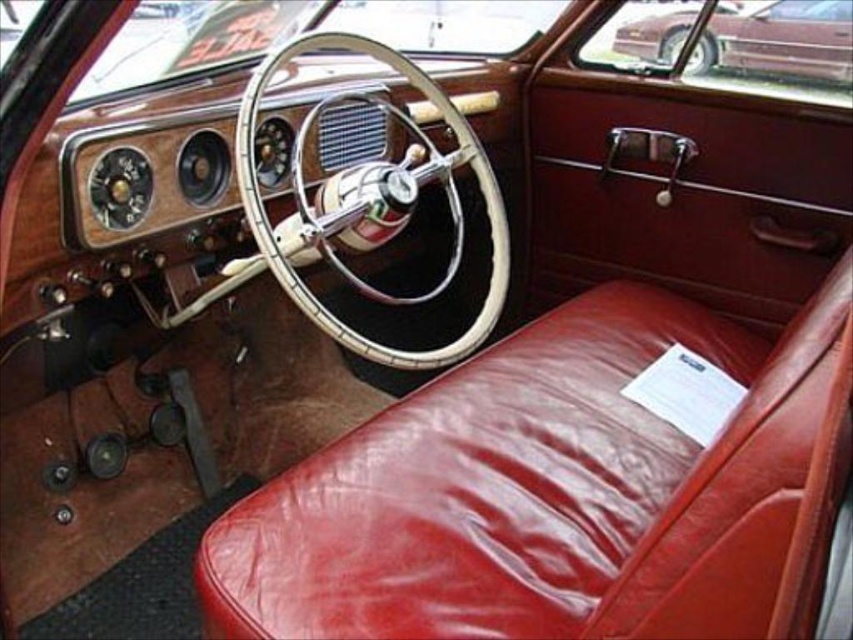
Is point (798, 580) positioned after point (766, 44)?

No, (798, 580) is closer to viewer.

Can you confirm if shiny leather seat at center is bigger than shiny maroon sedan at upper right?

Yes, shiny leather seat at center is bigger than shiny maroon sedan at upper right.

The image size is (853, 640). Identify the location of shiny leather seat at center. (560, 492).

Locate an element on the screen. The height and width of the screenshot is (640, 853). shiny leather seat at center is located at coordinates (560, 492).